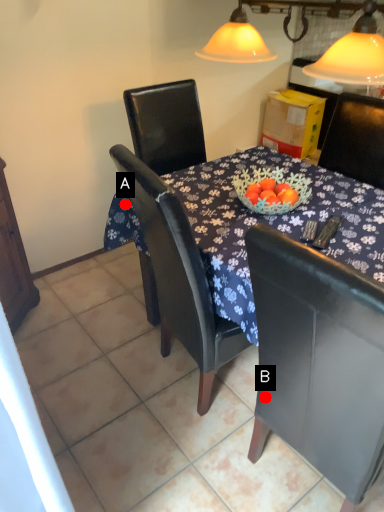
Question: Two points are circled on the image, labeled by A and B beside each circle. Which of the following is the farthest from the observer?

Choices:
 (A) A is further
 (B) B is further

Answer: (A)